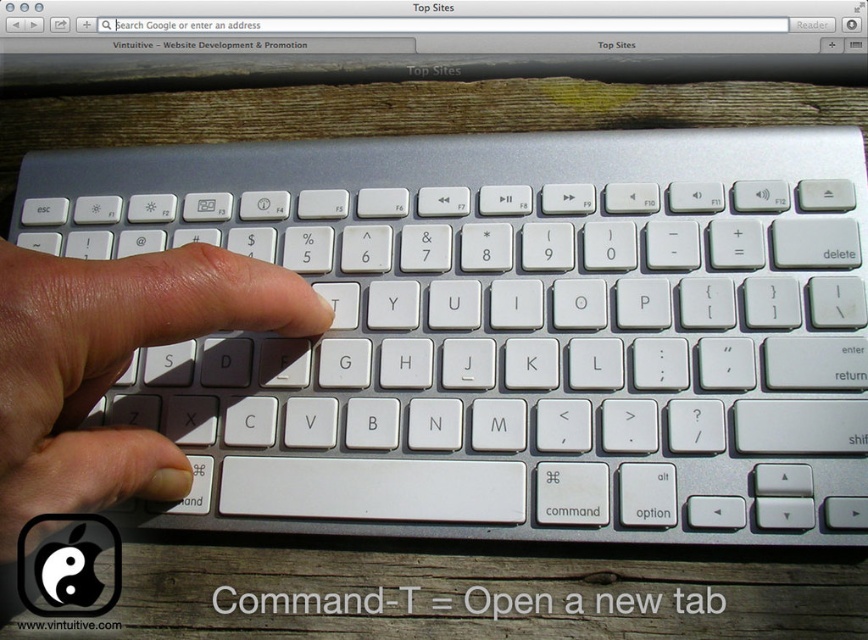
Question: Can you confirm if silver/plastic keyboard at center is positioned to the right of white matte keyboard at center?

Choices:
 (A) no
 (B) yes

Answer: (B)

Question: Which point is closer to the camera?

Choices:
 (A) white matte keyboard at center
 (B) satin silver computer screen at upper center
 (C) silver/plastic keyboard at center

Answer: (A)

Question: Can you confirm if silver/plastic keyboard at center is positioned above satin silver computer screen at upper center?

Choices:
 (A) yes
 (B) no

Answer: (B)

Question: Which is farther from the satin silver computer screen at upper center?

Choices:
 (A) white matte keyboard at center
 (B) silver/plastic keyboard at center

Answer: (A)

Question: Which object is the closest to the satin silver computer screen at upper center?

Choices:
 (A) silver/plastic keyboard at center
 (B) white matte keyboard at center

Answer: (A)

Question: Can you confirm if satin silver computer screen at upper center is thinner than white matte keyboard at center?

Choices:
 (A) no
 (B) yes

Answer: (A)